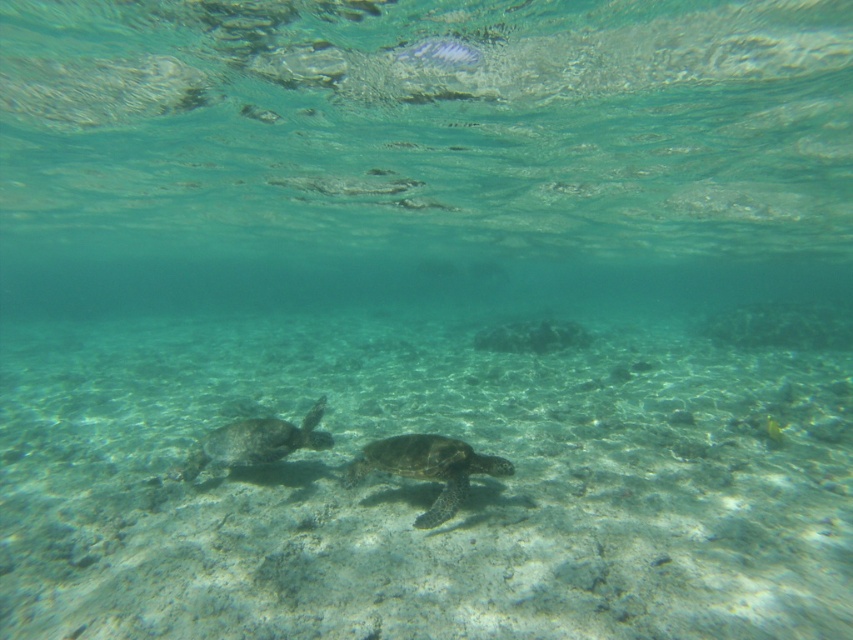
Question: Considering the relative positions of green textured shell at center and green matte turtle at lower left in the image provided, where is green textured shell at center located with respect to green matte turtle at lower left?

Choices:
 (A) above
 (B) below

Answer: (B)

Question: Which point appears closest to the camera in this image?

Choices:
 (A) 447,504
 (B) 253,433

Answer: (A)

Question: Considering the relative positions of green textured shell at center and green matte turtle at lower left in the image provided, where is green textured shell at center located with respect to green matte turtle at lower left?

Choices:
 (A) left
 (B) right

Answer: (B)

Question: Is green textured shell at center thinner than green matte turtle at lower left?

Choices:
 (A) yes
 (B) no

Answer: (A)